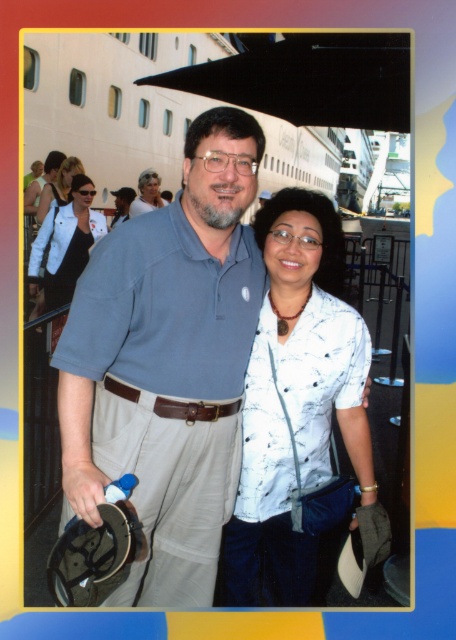
Question: Which point is farther to the camera?

Choices:
 (A) matte blue shirt at center
 (B) white smooth cruise ship at upper center
 (C) matte black shirt at center

Answer: (C)

Question: Can you confirm if white printed shirt at center is smaller than blonde hair at upper left?

Choices:
 (A) yes
 (B) no

Answer: (B)

Question: Which object appears closest to the camera in this image?

Choices:
 (A) blonde hair at upper left
 (B) matte blue shirt at center

Answer: (B)

Question: Is white matte jacket at center thinner than matte white blouse at center?

Choices:
 (A) no
 (B) yes

Answer: (A)

Question: Which object appears farthest from the camera in this image?

Choices:
 (A) matte white blouse at center
 (B) matte blue shirt at center
 (C) white matte jacket at center
 (D) matte black shirt at center

Answer: (D)

Question: Does white smooth cruise ship at upper center appear under matte black shirt at center?

Choices:
 (A) no
 (B) yes

Answer: (A)